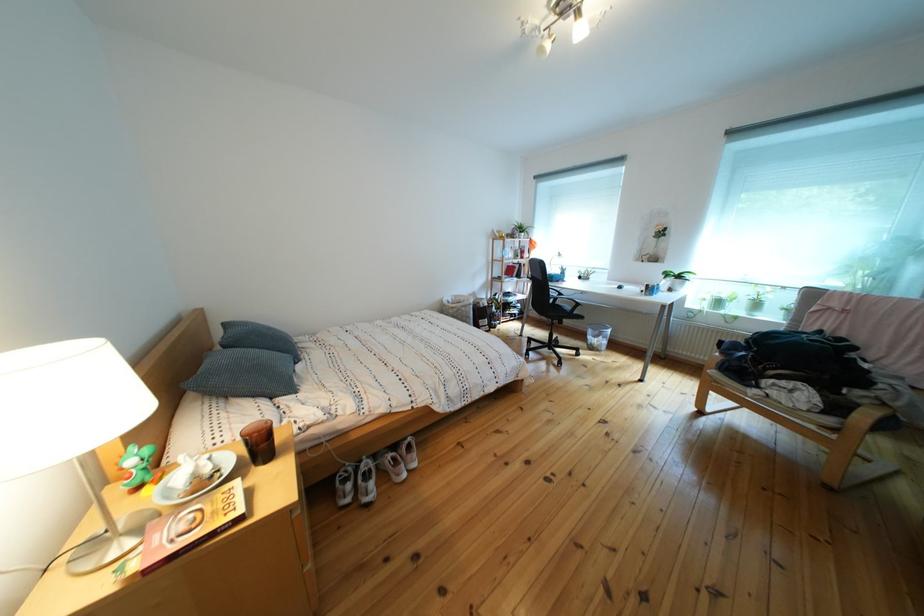
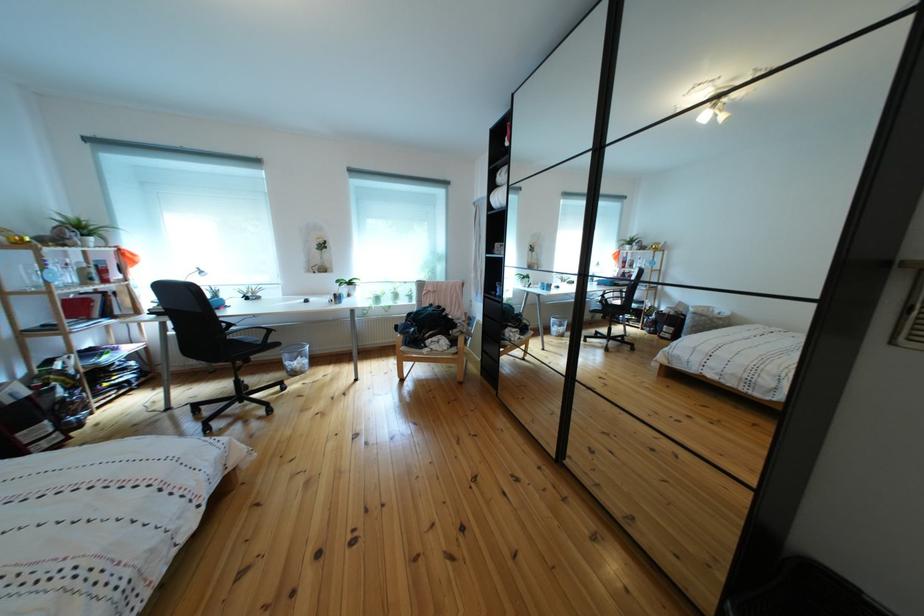
Question: The camera is either moving clockwise (left) or counter-clockwise (right) around the object. The first image is from the beginning of the video and the second image is from the end. Is the camera moving left or right when shooting the video?

Choices:
 (A) Left
 (B) Right

Answer: (A)